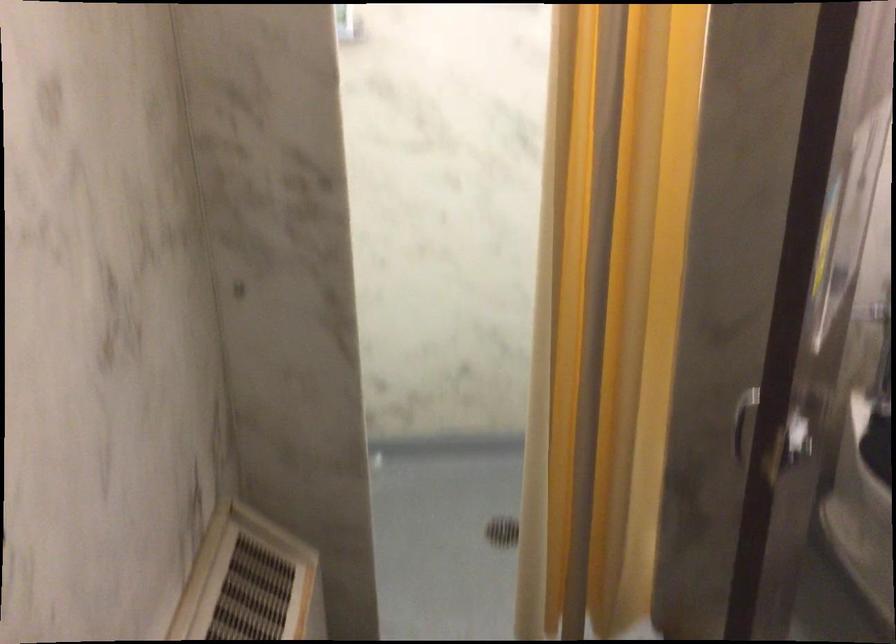
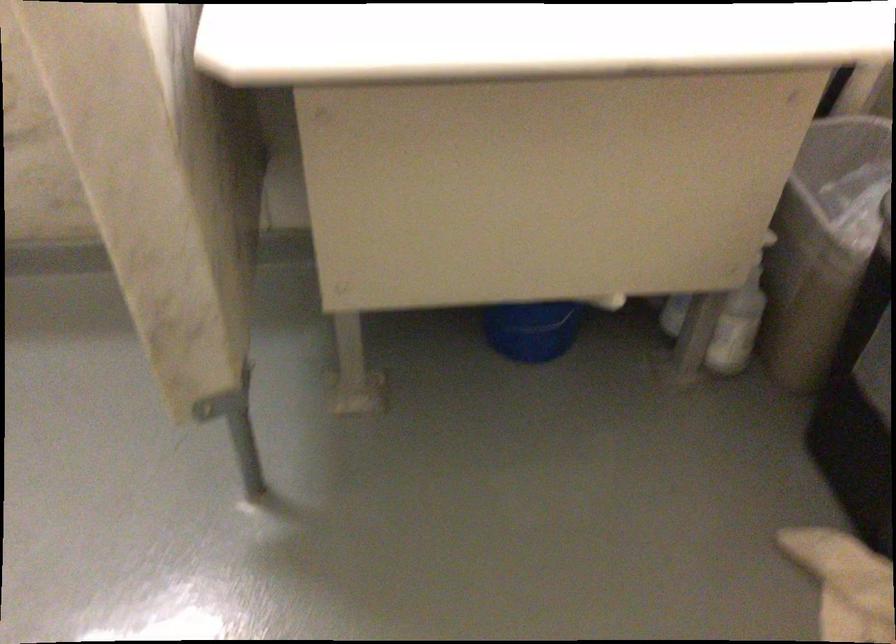
First-person continuous shooting, in which direction is the camera rotating?

The rotation direction of the camera is right-down.